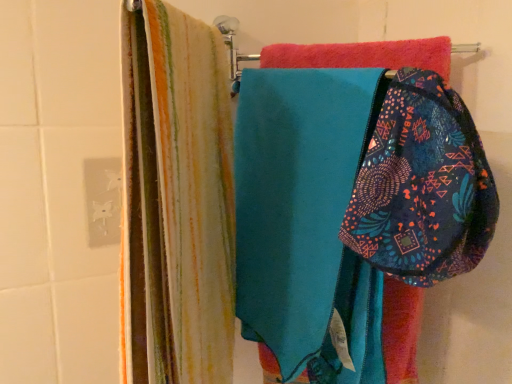
Question: Is patterned fabric pouch at center to the left or to the right of teal fabric at center in the image?

Choices:
 (A) right
 (B) left

Answer: (A)

Question: Considering the positions of patterned fabric pouch at center and teal fabric at center in the image, is patterned fabric pouch at center taller or shorter than teal fabric at center?

Choices:
 (A) tall
 (B) short

Answer: (B)

Question: Looking at their shapes, would you say patterned fabric pouch at center is wider or thinner than teal fabric at center?

Choices:
 (A) wide
 (B) thin

Answer: (B)

Question: Do you think teal fabric at center is within patterned fabric pouch at center, or outside of it?

Choices:
 (A) outside
 (B) inside

Answer: (A)

Question: From a real-world perspective, is teal fabric at center above or below patterned fabric pouch at center?

Choices:
 (A) above
 (B) below

Answer: (B)

Question: Considering the positions of teal fabric at center and patterned fabric pouch at center in the image, is teal fabric at center wider or thinner than patterned fabric pouch at center?

Choices:
 (A) wide
 (B) thin

Answer: (A)

Question: In terms of size, does teal fabric at center appear bigger or smaller than patterned fabric pouch at center?

Choices:
 (A) small
 (B) big

Answer: (B)